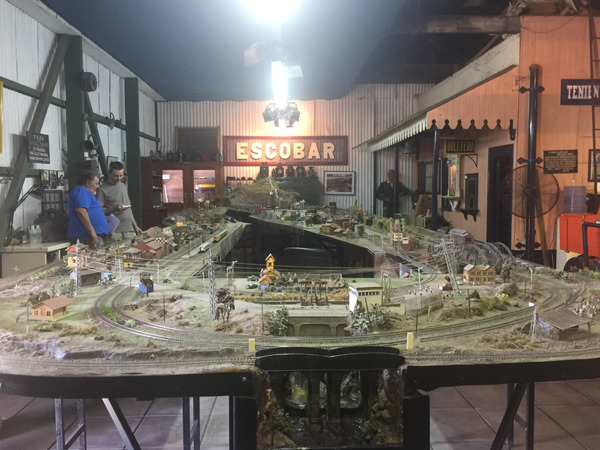
Identify the location of large table. (132, 385).